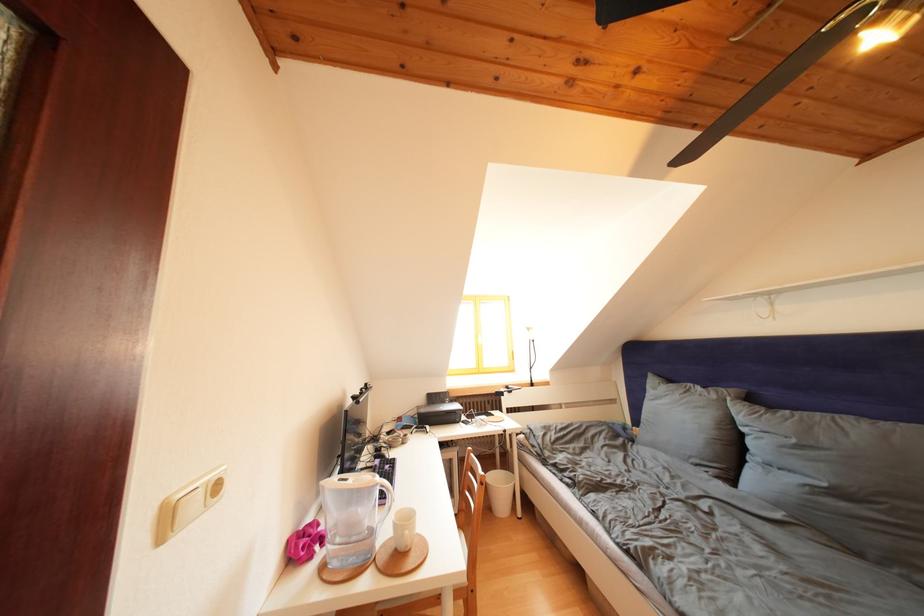
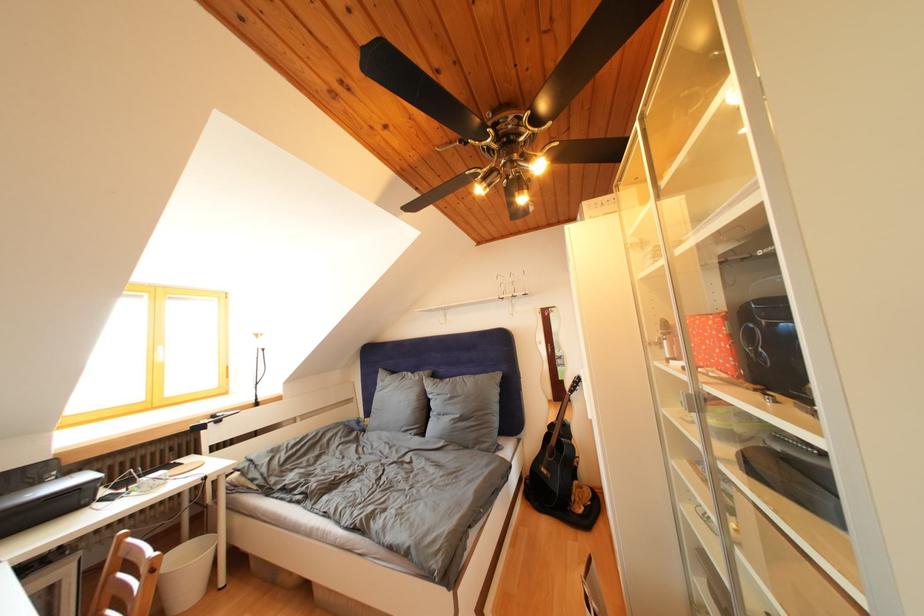
The point at (508, 490) is marked in the first image. Where is the corresponding point in the second image?

(198, 565)